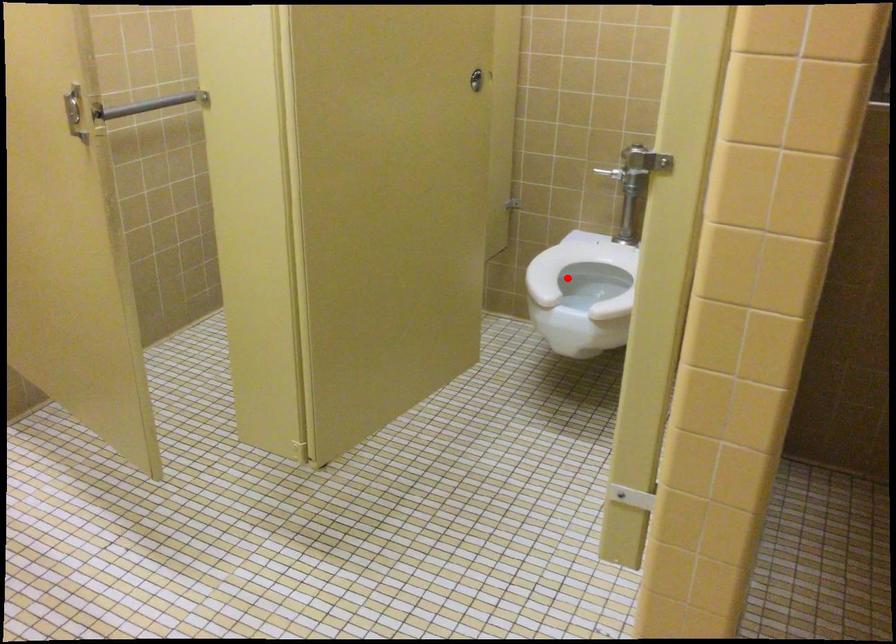
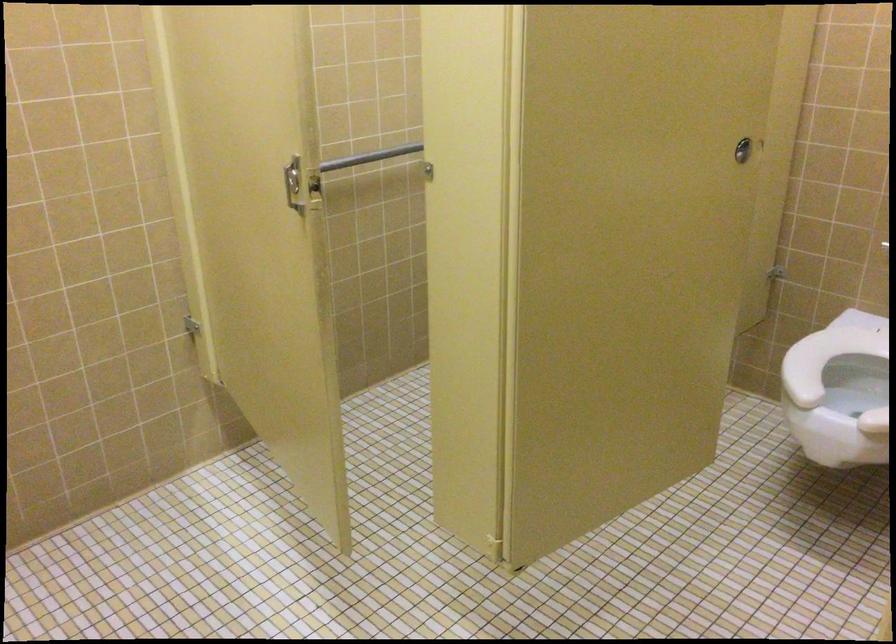
Locate, in the second image, the point that corresponds to the highlighted location in the first image.

(836, 362)